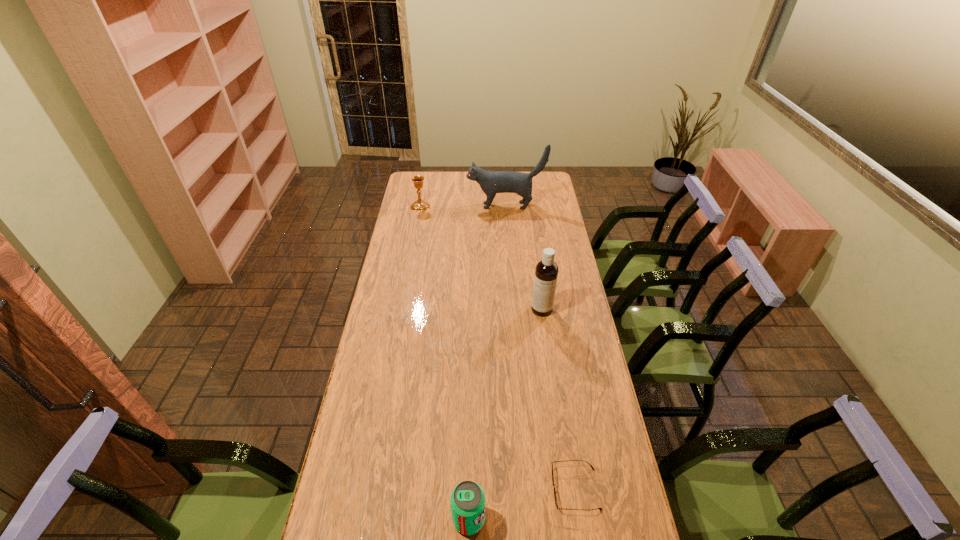
Locate an element on the screen. The height and width of the screenshot is (540, 960). cat is located at coordinates click(491, 182).

The width and height of the screenshot is (960, 540). In order to click on the third farthest object in this screenshot , I will do `click(546, 272)`.

Image resolution: width=960 pixels, height=540 pixels. I want to click on dishwasher detergent, so click(546, 272).

Locate an element on the screen. This screenshot has height=540, width=960. the leftmost object is located at coordinates (420, 205).

The height and width of the screenshot is (540, 960). I want to click on pop soda, so click(467, 499).

At what (x,y) coordinates should I click in order to perform the action: click on spectacles. Please return your answer as a coordinate pair (x, y). The image size is (960, 540). Looking at the image, I should click on (556, 504).

I want to click on vacant space located at the face of the cat, so click(x=418, y=206).

In order to click on vacant space positioned 0.110m at the face of the cat in this screenshot , I will do `click(446, 206)`.

Find the location of a particular element. vacant space located at the face of the cat is located at coordinates (446, 206).

Where is `vacant space located 0.120m on the label side of the third farthest object`? This screenshot has width=960, height=540. vacant space located 0.120m on the label side of the third farthest object is located at coordinates (546, 341).